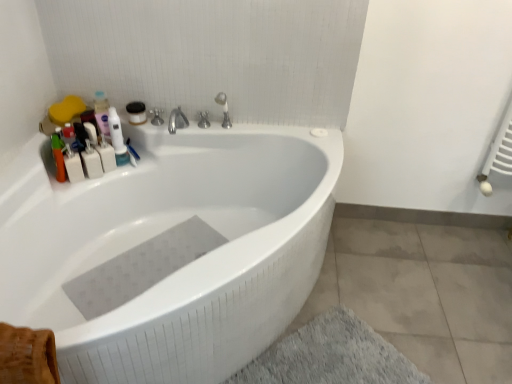
Find the location of a particular element. free space above gray rubber mat at bottom (from a real-world perspective) is located at coordinates (141, 248).